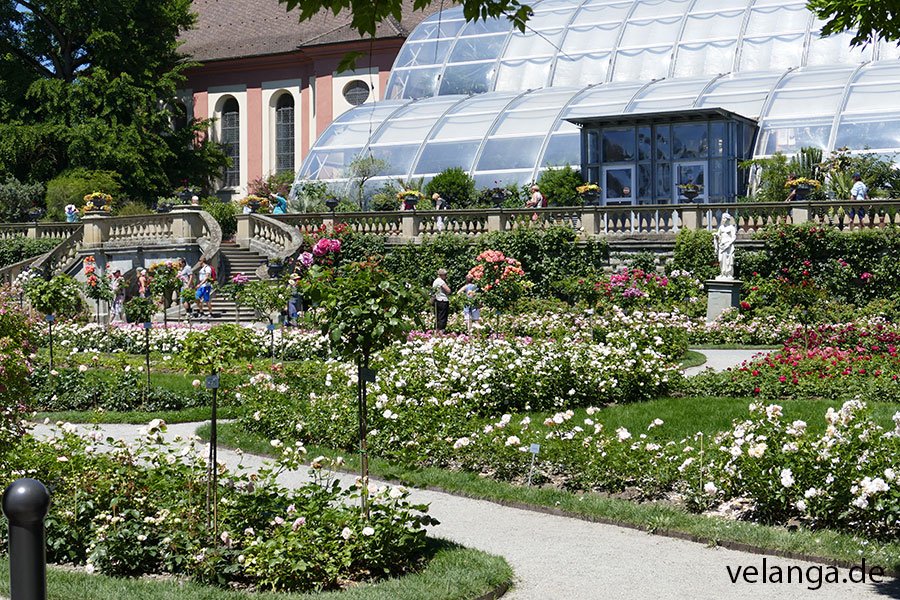
I want to click on statue, so click(x=722, y=256).